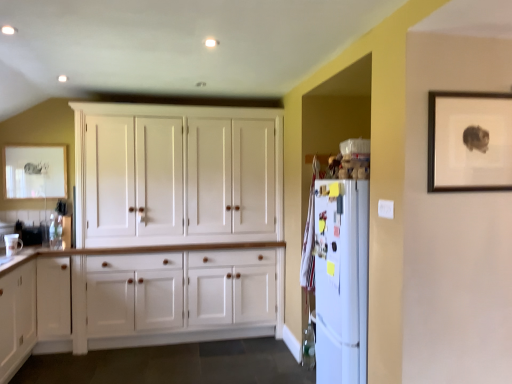
Identify the location of wooden picture frame at upper right, the second picture frame in the back-to-front sequence. The height and width of the screenshot is (384, 512). (469, 141).

At what (x,y) coordinates should I click in order to perform the action: click on white wood cabinet at lower left. Please return your answer as a coordinate pair (x, y). Image resolution: width=512 pixels, height=384 pixels. Looking at the image, I should click on (17, 318).

The width and height of the screenshot is (512, 384). Describe the element at coordinates (35, 171) in the screenshot. I see `matte white picture frame at upper left, the second picture frame viewed from the front` at that location.

What do you see at coordinates (12, 244) in the screenshot? I see `white glossy mug at lower left` at bounding box center [12, 244].

Measure the distance between point [58,278] and camera.

They are 3.64 meters apart.

Image resolution: width=512 pixels, height=384 pixels. What are the coordinates of `wooden picture frame at upper right, which is counted as the 2th picture frame, starting from the left` in the screenshot? It's located at (469, 141).

In the image, there is a white wood cabinet at lower left. Where is `refrigerator above it (from the image's perspective)`? refrigerator above it (from the image's perspective) is located at coordinates (341, 280).

Considering the positions of objects white wood cabinet at lower left and white matte refrigerator at right in the image provided, who is more to the left, white wood cabinet at lower left or white matte refrigerator at right?

Positioned to the left is white wood cabinet at lower left.

How far apart are white wood cabinet at lower left and white matte refrigerator at right?

A distance of 2.21 meters exists between white wood cabinet at lower left and white matte refrigerator at right.

Does white wood cabinet at lower left contain white matte refrigerator at right?

No, white matte refrigerator at right is not inside white wood cabinet at lower left.

Can you confirm if white wood cabinet at lower left is taller than white glossy mug at lower left?

Yes, white wood cabinet at lower left is taller than white glossy mug at lower left.

Which object is more forward, white wood cabinet at lower left or white glossy mug at lower left?

white wood cabinet at lower left is in front.

From a real-world perspective, is white wood cabinet at lower left located beneath white glossy mug at lower left?

Yes, from a real-world perspective, white wood cabinet at lower left is under white glossy mug at lower left.

Which point is more distant from viewer, (10,367) or (14,239)?

The point (14,239) is farther.

From a real-world perspective, which is physically below, white wood cabinet at lower left or white wood cupboard at center?

From a 3D spatial view, white wood cabinet at lower left is below.

Can you confirm if white wood cabinet at lower left is positioned to the right of white wood cupboard at center?

No.

From the image's perspective, which one is positioned lower, white wood cabinet at lower left or white wood cupboard at center?

white wood cabinet at lower left.

Does white wood cabinet at lower left turn towards white wood cupboard at center?

Yes, white wood cabinet at lower left is aimed at white wood cupboard at center.

Can white wood cupboard at center be found inside matte white picture frame at upper left, which is the first picture frame from left to right?

No.

Identify the location of cupboard below the matte white picture frame at upper left, the second picture frame in the right-to-left sequence (from a real-world perspective). (160, 235).

Considering the sizes of matte white picture frame at upper left, which is the first picture frame from left to right, and white wood cupboard at center in the image, is matte white picture frame at upper left, which is the first picture frame from left to right, wider or thinner than white wood cupboard at center?

Clearly, matte white picture frame at upper left, which is the first picture frame from left to right, has less width compared to white wood cupboard at center.

Is white wood cupboard at center in contact with white wood cabinet at lower left?

No, white wood cupboard at center is not touching white wood cabinet at lower left.

Would you say white wood cupboard at center contains white wood cabinet at lower left?

No.

Can you confirm if white wood cupboard at center is positioned to the right of white wood cabinet at lower left?

Correct, you'll find white wood cupboard at center to the right of white wood cabinet at lower left.

From the image's perspective, is white wood cupboard at center on white wood cabinet at lower left?

Yes, from the image's perspective, white wood cupboard at center is on top of white wood cabinet at lower left.

Is matte white picture frame at upper left, the second picture frame viewed from the front, not inside white glossy mug at lower left?

Yes.

From the picture: Is matte white picture frame at upper left, the second picture frame viewed from the front, beside white glossy mug at lower left?

No, matte white picture frame at upper left, the second picture frame viewed from the front, is not in contact with white glossy mug at lower left.

From a real-world perspective, who is located lower, matte white picture frame at upper left, the second picture frame viewed from the front, or white glossy mug at lower left?

white glossy mug at lower left, from a real-world perspective.

In terms of width, does matte white picture frame at upper left, which is counted as the first picture frame, starting from the back, look wider or thinner when compared to white glossy mug at lower left?

Clearly, matte white picture frame at upper left, which is counted as the first picture frame, starting from the back, has less width compared to white glossy mug at lower left.

In the scene shown: Which point is more distant from viewer, (x=367, y=274) or (x=39, y=284)?

Positioned behind is point (x=39, y=284).

From a real-world perspective, is white matte refrigerator at right positioned over white wood cabinet at lower left based on gravity?

Yes, from a real-world perspective, white matte refrigerator at right is on top of white wood cabinet at lower left.

Is white matte refrigerator at right in contact with white wood cabinet at lower left?

No, white matte refrigerator at right is not in contact with white wood cabinet at lower left.

From the image's perspective, which one is positioned lower, white matte refrigerator at right or white wood cabinet at lower left?

white wood cabinet at lower left appears lower in the image.

Find the location of a particular element. cabinetry below the white matte refrigerator at right (from the image's perspective) is located at coordinates (17, 318).

This screenshot has height=384, width=512. I want to click on cabinetry that appears below the white glossy mug at lower left (from a real-world perspective), so click(x=17, y=318).

Based on their spatial positions, is white wood cupboard at center or white wood cabinet at lower left closer to white wood cabinet at lower left?

The object closer to white wood cabinet at lower left is white wood cabinet at lower left.

When comparing their distances from wooden picture frame at upper right, the second picture frame in the back-to-front sequence, does matte white picture frame at upper left, which is counted as the first picture frame, starting from the back, or white glossy mug at lower left seem closer?

Among the two, white glossy mug at lower left is located nearer to wooden picture frame at upper right, the second picture frame in the back-to-front sequence.

From the image, which object appears to be farther from white wood cabinet at lower left, white wood cupboard at center or matte white picture frame at upper left, the second picture frame viewed from the front?

matte white picture frame at upper left, the second picture frame viewed from the front, lies further to white wood cabinet at lower left than the other object.

When comparing their distances from white wood cabinet at lower left, does white wood cabinet at lower left or wooden picture frame at upper right, the second picture frame in the back-to-front sequence, seem closer?

The object closer to white wood cabinet at lower left is white wood cabinet at lower left.

From the image, which object appears to be nearer to white matte refrigerator at right, wooden picture frame at upper right, marked as the 1th picture frame in a front-to-back arrangement, or white glossy mug at lower left?

wooden picture frame at upper right, marked as the 1th picture frame in a front-to-back arrangement, is closer to white matte refrigerator at right.

Looking at the image, which one is located further to white wood cabinet at lower left, white wood cabinet at lower left or white wood cupboard at center?

Among the two, white wood cupboard at center is located further to white wood cabinet at lower left.

From the image, which object appears to be nearer to white wood cabinet at lower left, wooden picture frame at upper right, the 1th picture frame from the right, or white wood cupboard at center?

white wood cupboard at center is positioned closer to the anchor white wood cabinet at lower left.

Looking at this image, considering their positions, is white wood cupboard at center positioned further to white glossy mug at lower left than white wood cabinet at lower left?

The object further to white glossy mug at lower left is white wood cupboard at center.

Where is `dresser between white wood cabinet at lower left and white matte refrigerator at right`? Image resolution: width=512 pixels, height=384 pixels. dresser between white wood cabinet at lower left and white matte refrigerator at right is located at coordinates (33, 310).

Find the location of a particular element. This screenshot has height=384, width=512. refrigerator located between white wood cupboard at center and wooden picture frame at upper right, marked as the 1th picture frame in a front-to-back arrangement, in the left-right direction is located at coordinates pyautogui.click(x=341, y=280).

Find the location of a particular element. Image resolution: width=512 pixels, height=384 pixels. cupboard between white glossy mug at lower left and wooden picture frame at upper right, the 1th picture frame from the right, from left to right is located at coordinates (160, 235).

The width and height of the screenshot is (512, 384). What are the coordinates of `dresser between matte white picture frame at upper left, the second picture frame in the right-to-left sequence, and wooden picture frame at upper right, the 1th picture frame from the right, from left to right` in the screenshot? It's located at (33, 310).